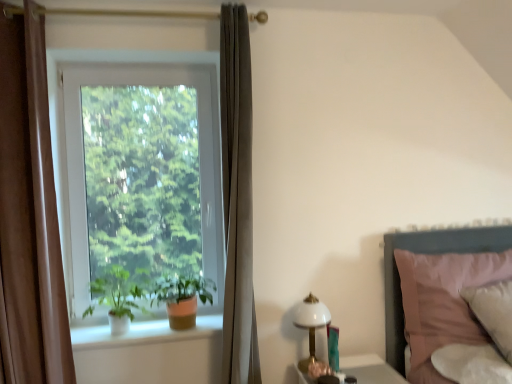
You are a GUI agent. You are given a task and a screenshot of the screen. Output one action in this format:
    pyautogui.click(x=<x>, y=<y>)
    Task: Click on the vacant area on top of white plastic window at left (from a real-world perspective)
    
    Given the screenshot: What is the action you would take?
    pyautogui.click(x=136, y=64)